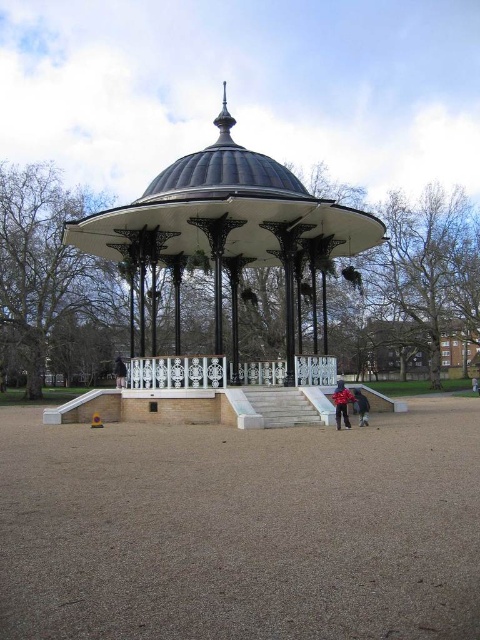
You are planning to set up a small stage for a performance in the park. The stage requires a minimum space of 30 feet between the bandstand and any audience members. Given the distance between the white painted metal gazebo at center and the red fabric jacket at center, is this location suitable for your setup?

The white painted metal gazebo at center and the red fabric jacket at center are 31.73 feet apart. Since the required minimum space is 30 feet, this location is suitable for the setup as the distance meets the requirement.

You are standing at the center of the park and want to locate the white painted metal gazebo at center. According to the coordinates provided, in which direction should you move to reach it?

The white painted metal gazebo at center is located at coordinates point (228,218), so you should move towards that point to reach it.

You are a photographer planning to take a picture of the bandstand. You notice the red jacket at lower center and the black fabric at lower center in your frame. Which object should you adjust your camera angle to exclude if you want to focus more on the bandstand itself?

You should adjust your camera angle to exclude the red jacket at lower center because it occupies less space and would be easier to remove from the frame while keeping the larger black fabric at lower center, allowing the bandstand to be the main focus.